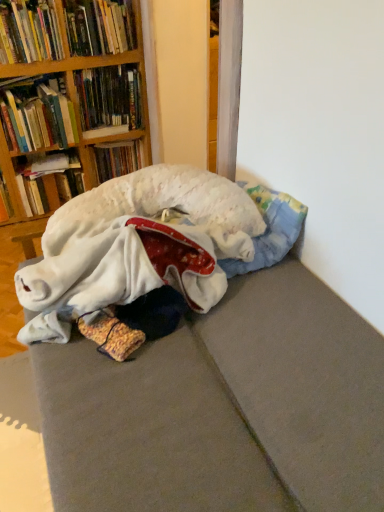
Question: Does hardcover book at upper left, the fourth book when ordered from top to bottom, lie behind hardcover book at left, acting as the seventh book starting from the top?

Choices:
 (A) no
 (B) yes

Answer: (A)

Question: Does hardcover book at upper left, the fourth book when ordered from top to bottom, lie in front of hardcover book at left, acting as the seventh book starting from the top?

Choices:
 (A) yes
 (B) no

Answer: (A)

Question: Can you confirm if hardcover book at upper left, the fourth book when ordered from top to bottom, is smaller than hardcover book at left, the first book positioned from the bottom?

Choices:
 (A) no
 (B) yes

Answer: (A)

Question: Could you tell me if hardcover book at upper left, the fourth book from the bottom, is facing hardcover book at left, acting as the seventh book starting from the top?

Choices:
 (A) yes
 (B) no

Answer: (B)

Question: Is hardcover book at upper left, the fourth book from the bottom, bigger than hardcover book at left, the first book positioned from the bottom?

Choices:
 (A) yes
 (B) no

Answer: (A)

Question: Considering the positions of point (130, 454) and point (104, 155), is point (130, 454) closer or farther from the camera than point (104, 155)?

Choices:
 (A) farther
 (B) closer

Answer: (B)

Question: Do you think washed fabric bed at lower left is within hardcover book at upper left, the fifth book positioned from the top, or outside of it?

Choices:
 (A) inside
 (B) outside

Answer: (B)

Question: From the image's perspective, is washed fabric bed at lower left located above or below hardcover book at upper left, the fifth book positioned from the top?

Choices:
 (A) above
 (B) below

Answer: (B)

Question: Would you say washed fabric bed at lower left is to the left or to the right of hardcover book at upper left, which ranks as the third book in bottom-to-top order, in the picture?

Choices:
 (A) right
 (B) left

Answer: (A)

Question: Based on their sizes in the image, would you say hardcover book at upper left, marked as the 2th book in a top-to-bottom arrangement, is bigger or smaller than washed fabric bed at lower left?

Choices:
 (A) big
 (B) small

Answer: (B)

Question: From a real-world perspective, is hardcover book at upper left, placed as the sixth book when sorted from bottom to top, physically located above or below washed fabric bed at lower left?

Choices:
 (A) above
 (B) below

Answer: (A)

Question: Looking at their shapes, would you say hardcover book at upper left, placed as the sixth book when sorted from bottom to top, is wider or thinner than washed fabric bed at lower left?

Choices:
 (A) wide
 (B) thin

Answer: (B)

Question: Considering the positions of hardcover book at upper left, placed as the sixth book when sorted from bottom to top, and washed fabric bed at lower left in the image, is hardcover book at upper left, placed as the sixth book when sorted from bottom to top, taller or shorter than washed fabric bed at lower left?

Choices:
 (A) tall
 (B) short

Answer: (B)

Question: Is hardcover book at left, the first book positioned from the bottom, in front of or behind washed fabric bed at lower left in the image?

Choices:
 (A) behind
 (B) front

Answer: (A)

Question: Is hardcover book at left, acting as the seventh book starting from the top, taller or shorter than washed fabric bed at lower left?

Choices:
 (A) tall
 (B) short

Answer: (B)